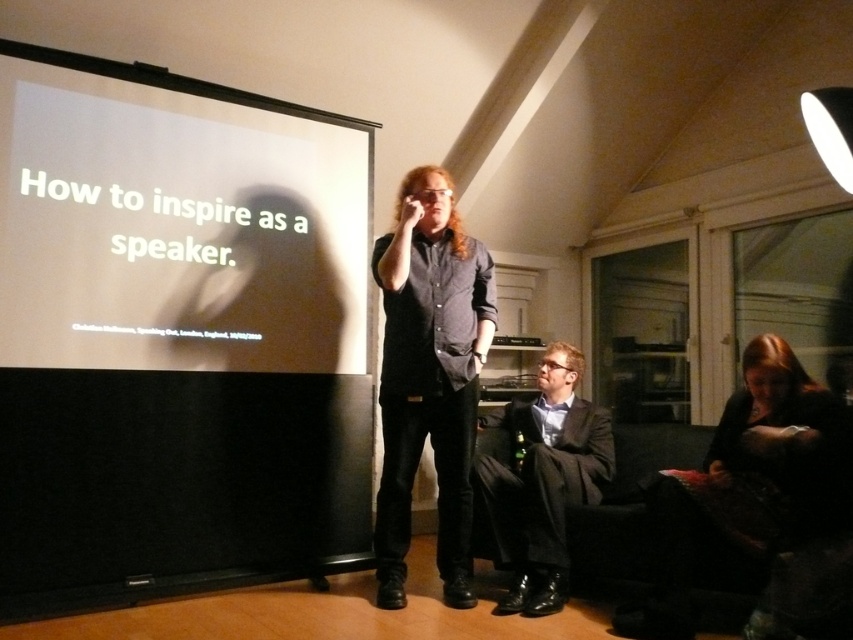
Is white matte projection screen at upper left shorter than dark gray suit at center?

In fact, white matte projection screen at upper left may be taller than dark gray suit at center.

Can you confirm if white matte projection screen at upper left is wider than dark gray suit at center?

Yes.

Is point (245, 257) closer to viewer compared to point (566, 476)?

No, (245, 257) is further to viewer.

You are a GUI agent. You are given a task and a screenshot of the screen. Output one action in this format:
    pyautogui.click(x=<x>, y=<y>)
    Task: Click on the white matte projection screen at upper left
    The image size is (853, 640).
    Given the screenshot: What is the action you would take?
    pyautogui.click(x=173, y=224)

Is dark brown leather jacket at lower right thinner than dark gray suit at center?

In fact, dark brown leather jacket at lower right might be wider than dark gray suit at center.

Where is `dark brown leather jacket at lower right`? dark brown leather jacket at lower right is located at coordinates [x=747, y=488].

Does dark gray shirt at center lie behind dark gray suit at center?

That is False.

Which is below, dark gray shirt at center or dark gray suit at center?

dark gray suit at center is lower down.

In order to click on dark gray shirt at center in this screenshot , I will do `click(428, 376)`.